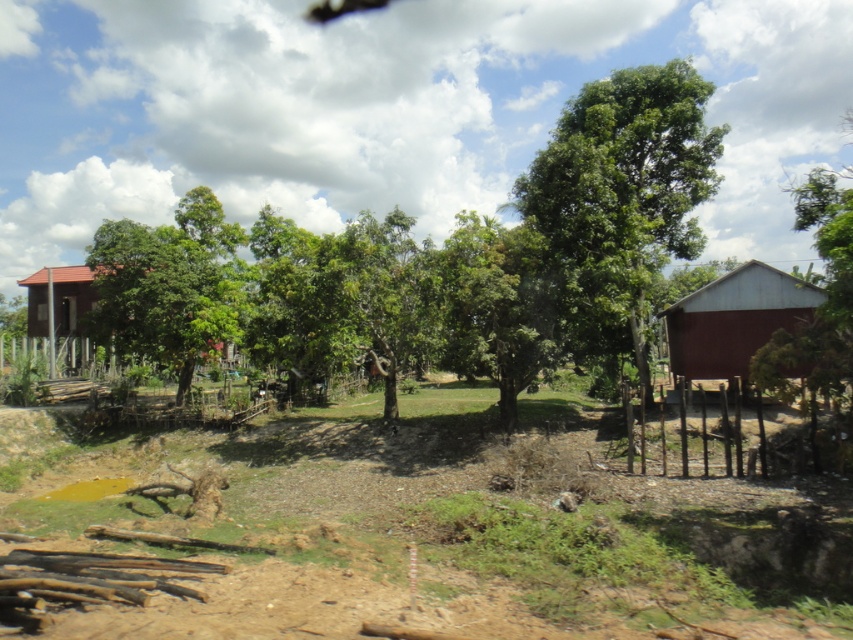
Question: Is brown soil at center thinner than matte red wooden hut at left?

Choices:
 (A) no
 (B) yes

Answer: (A)

Question: Which object is positioned farthest from the red wood hut at right?

Choices:
 (A) brown soil at center
 (B) matte red wooden hut at left

Answer: (B)

Question: Which object is positioned farthest from the red wood hut at right?

Choices:
 (A) matte red wooden hut at left
 (B) brown soil at center
 (C) green leafy tree at center

Answer: (A)

Question: Is brown soil at center to the left of red wood hut at right from the viewer's perspective?

Choices:
 (A) no
 (B) yes

Answer: (B)

Question: Can you confirm if green leafy tree at center is positioned below matte red wooden hut at left?

Choices:
 (A) no
 (B) yes

Answer: (A)

Question: Which object is the closest to the green leafy tree at center?

Choices:
 (A) brown soil at center
 (B) matte red wooden hut at left
 (C) red wood hut at right

Answer: (C)